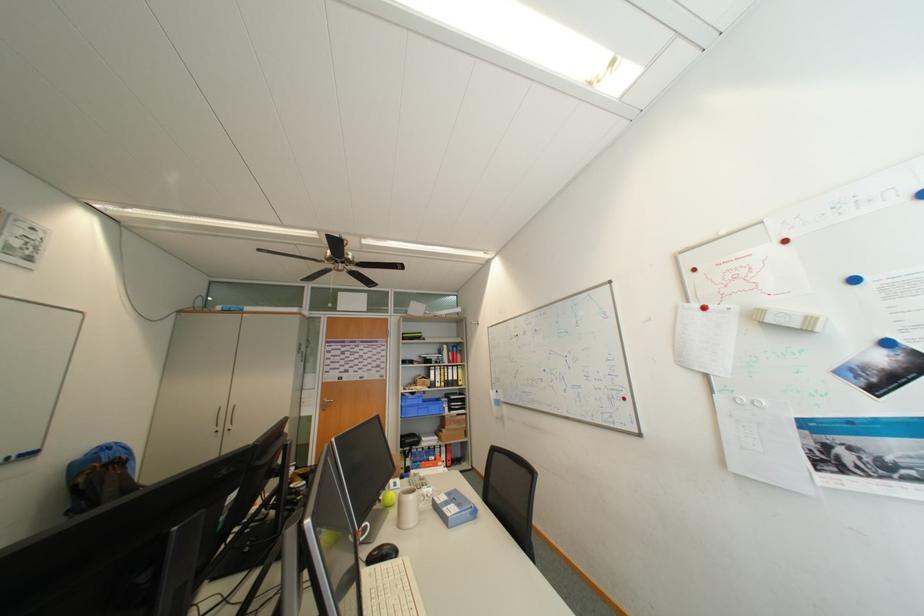
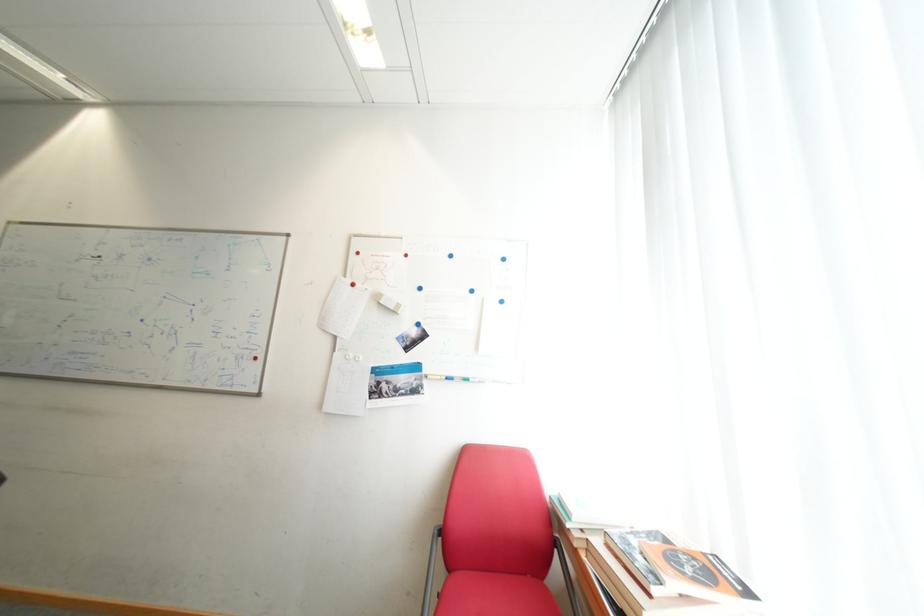
Question: Based on the continuous images, in which direction is the camera rotating? Reply with the corresponding letter.

Choices:
 (A) Left
 (B) Right
 (C) Up
 (D) Down

Answer: (B)